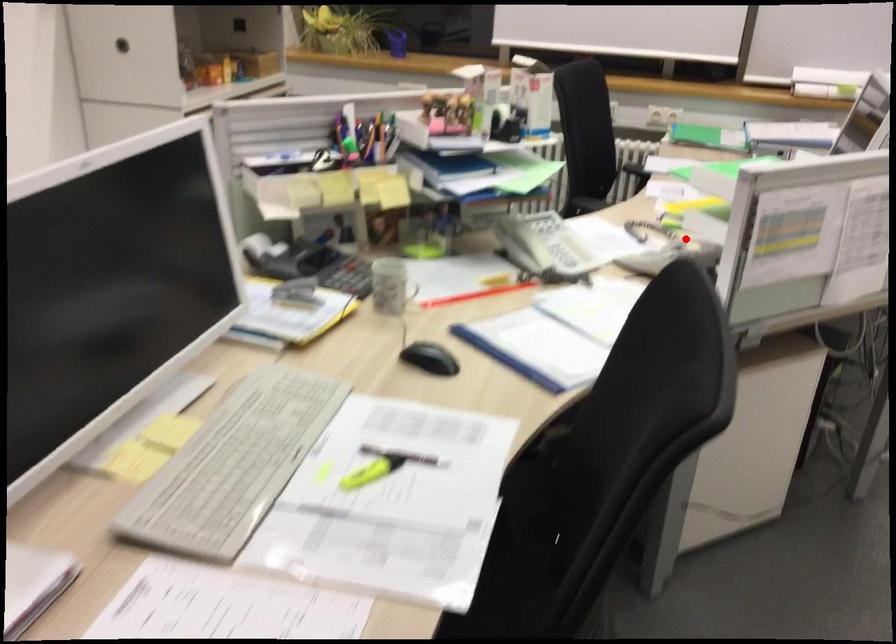
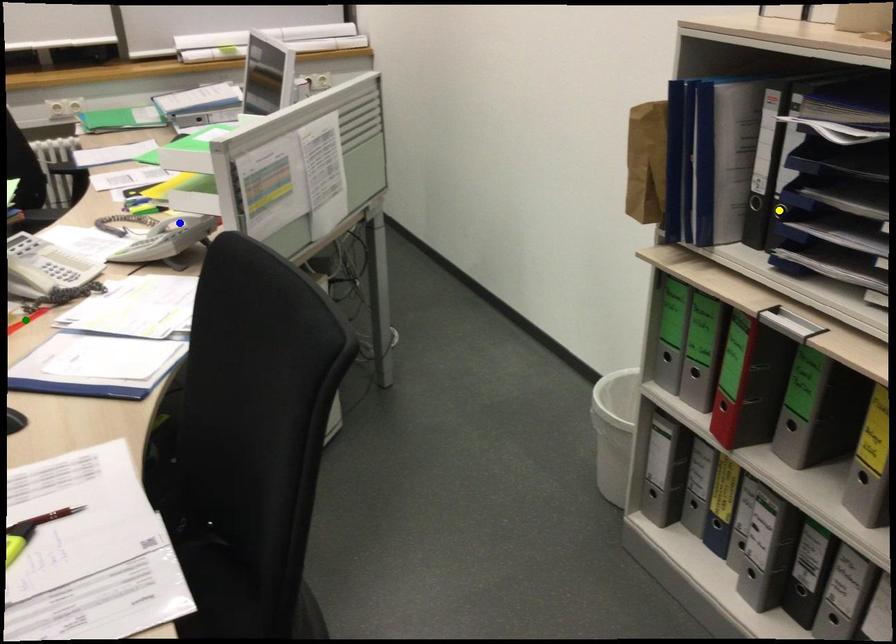
Question: I am providing you with two images of the same scene from different viewpoints. A red point is marked on the first image. You are given multiple points on the second image. Which point in image 2 represents the same 3d spot as the red point in image 1?

Choices:
 (A) yellow point
 (B) blue point
 (C) green point

Answer: (B)